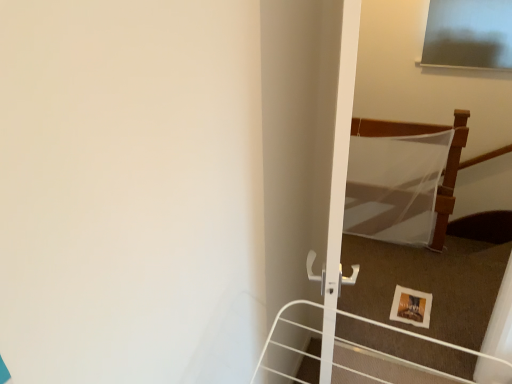
Find the location of `wooden picture frame at lower right`. wooden picture frame at lower right is located at coordinates (411, 307).

Measure the distance between point [411,301] and camera.

The depth of point [411,301] is 2.53 meters.

What do you see at coordinates (411, 307) in the screenshot?
I see `wooden picture frame at lower right` at bounding box center [411, 307].

What do you see at coordinates (446, 165) in the screenshot?
I see `white sheer fabric at upper right` at bounding box center [446, 165].

You are a GUI agent. You are given a task and a screenshot of the screen. Output one action in this format:
    pyautogui.click(x=<x>, y=<y>)
    Task: Click on the white sheer fabric at upper right
    The image size is (512, 384).
    Given the screenshot: What is the action you would take?
    pyautogui.click(x=446, y=165)

The height and width of the screenshot is (384, 512). I want to click on wooden picture frame at lower right, so click(411, 307).

Based on their positions, is wooden picture frame at lower right located to the left or right of white sheer fabric at upper right?

wooden picture frame at lower right is positioned on white sheer fabric at upper right's left side.

Which object is further away from the camera, wooden picture frame at lower right or white sheer fabric at upper right?

white sheer fabric at upper right is more distant.

Which point is more forward, (400, 294) or (412, 123)?

The point (400, 294) is closer to the camera.

From the image's perspective, would you say wooden picture frame at lower right is shown under white sheer fabric at upper right?

Indeed, from the image's perspective, wooden picture frame at lower right is shown beneath white sheer fabric at upper right.

From a real-world perspective, is wooden picture frame at lower right below white sheer fabric at upper right?

Indeed, from a real-world perspective, wooden picture frame at lower right is positioned beneath white sheer fabric at upper right.

Looking at this image, can you confirm if wooden picture frame at lower right is wider than white sheer fabric at upper right?

Yes.

Can you confirm if wooden picture frame at lower right is shorter than white sheer fabric at upper right?

Correct, wooden picture frame at lower right is not as tall as white sheer fabric at upper right.

Between wooden picture frame at lower right and white sheer fabric at upper right, which one has larger size?

white sheer fabric at upper right is bigger.

Choose the correct answer: Is wooden picture frame at lower right inside white sheer fabric at upper right or outside it?

wooden picture frame at lower right is outside white sheer fabric at upper right.

Are wooden picture frame at lower right and white sheer fabric at upper right beside each other?

No, wooden picture frame at lower right is not making contact with white sheer fabric at upper right.

Is white sheer fabric at upper right at the back of wooden picture frame at lower right?

Yes, white sheer fabric at upper right is at the back of wooden picture frame at lower right.

Measure the distance between wooden picture frame at lower right and white sheer fabric at upper right.

wooden picture frame at lower right is 72.51 centimeters from white sheer fabric at upper right.

Where is `bed behind the wooden picture frame at lower right`? The height and width of the screenshot is (384, 512). bed behind the wooden picture frame at lower right is located at coordinates (446, 165).

Which is more to the left, white sheer fabric at upper right or wooden picture frame at lower right?

wooden picture frame at lower right.

Does white sheer fabric at upper right lie in front of wooden picture frame at lower right?

No, it is behind wooden picture frame at lower right.

Which is behind, point (452, 155) or point (396, 297)?

The point (452, 155) is farther from the camera.

Based on the photo, from the image's perspective, is white sheer fabric at upper right positioned above or below wooden picture frame at lower right?

white sheer fabric at upper right is above wooden picture frame at lower right.

From a real-world perspective, is white sheer fabric at upper right below wooden picture frame at lower right?

Actually, white sheer fabric at upper right is physically above wooden picture frame at lower right in the real world.

Which of these two, white sheer fabric at upper right or wooden picture frame at lower right, is thinner?

white sheer fabric at upper right is thinner.

In the scene shown: Is white sheer fabric at upper right taller than wooden picture frame at lower right?

Yes.

Does white sheer fabric at upper right have a larger size compared to wooden picture frame at lower right?

Correct, white sheer fabric at upper right is larger in size than wooden picture frame at lower right.

Is white sheer fabric at upper right not inside wooden picture frame at lower right?

Yes.

Is white sheer fabric at upper right beside wooden picture frame at lower right?

No, white sheer fabric at upper right is not touching wooden picture frame at lower right.

Is white sheer fabric at upper right facing towards wooden picture frame at lower right?

Yes, white sheer fabric at upper right is facing wooden picture frame at lower right.

How many degrees apart are the facing directions of white sheer fabric at upper right and wooden picture frame at lower right?

The facing directions of white sheer fabric at upper right and wooden picture frame at lower right are 0.0013 degrees apart.

You are a GUI agent. You are given a task and a screenshot of the screen. Output one action in this format:
    pyautogui.click(x=<x>, y=<y>)
    Task: Click on the bed to the right of wooden picture frame at lower right
    This screenshot has width=512, height=384.
    Given the screenshot: What is the action you would take?
    pyautogui.click(x=446, y=165)

Locate an element on the screen. picture frame below the white sheer fabric at upper right (from a real-world perspective) is located at coordinates (411, 307).

The image size is (512, 384). In order to click on bed above the wooden picture frame at lower right (from a real-world perspective) in this screenshot , I will do click(x=446, y=165).